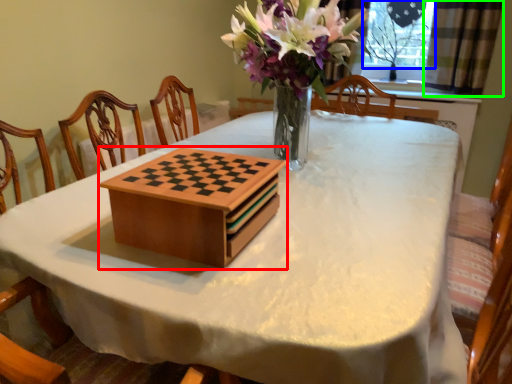
Question: Considering the real-world distances, which object is farthest from cardboard box (highlighted by a red box)? window screen (highlighted by a blue box) or curtain (highlighted by a green box)?

Choices:
 (A) window screen
 (B) curtain

Answer: (A)